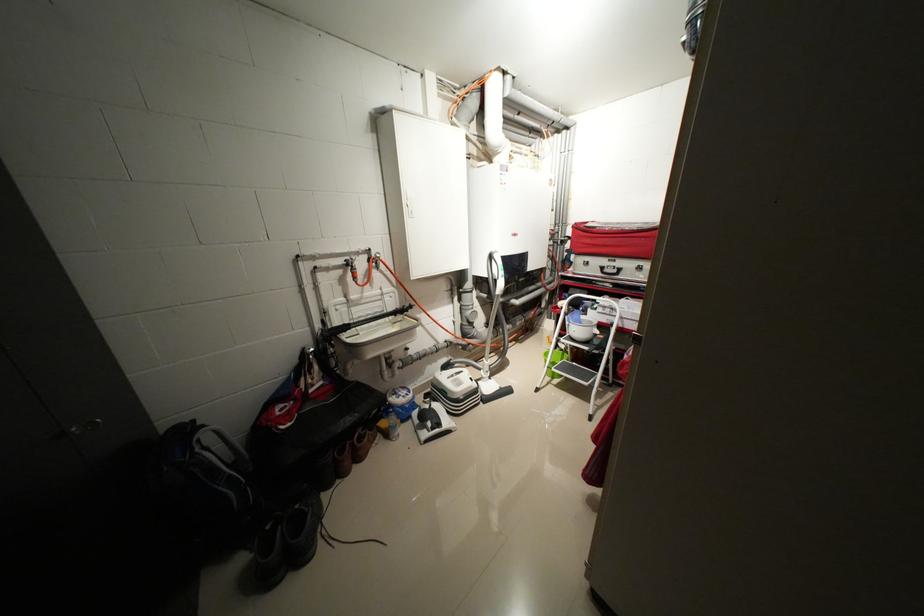
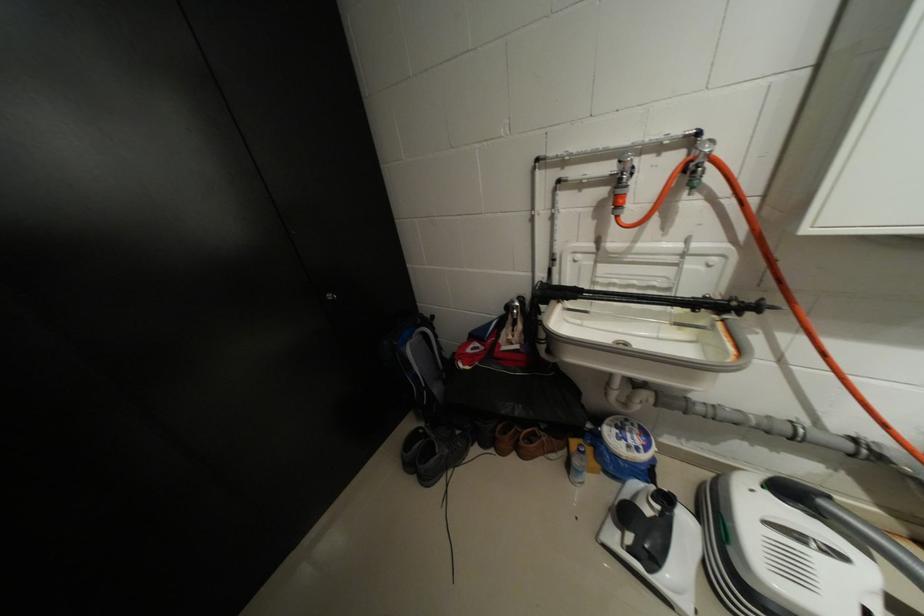
How did the camera likely rotate?

The rotation direction of the camera is left-down.